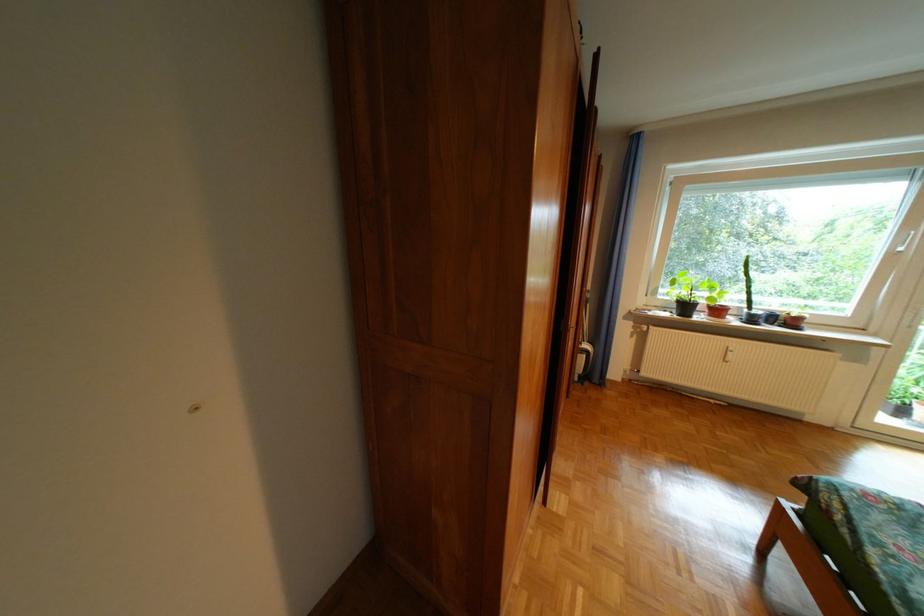
Where would you turn the radiator control handle? Please return your answer as a coordinate pair (x, y).

(727, 354)